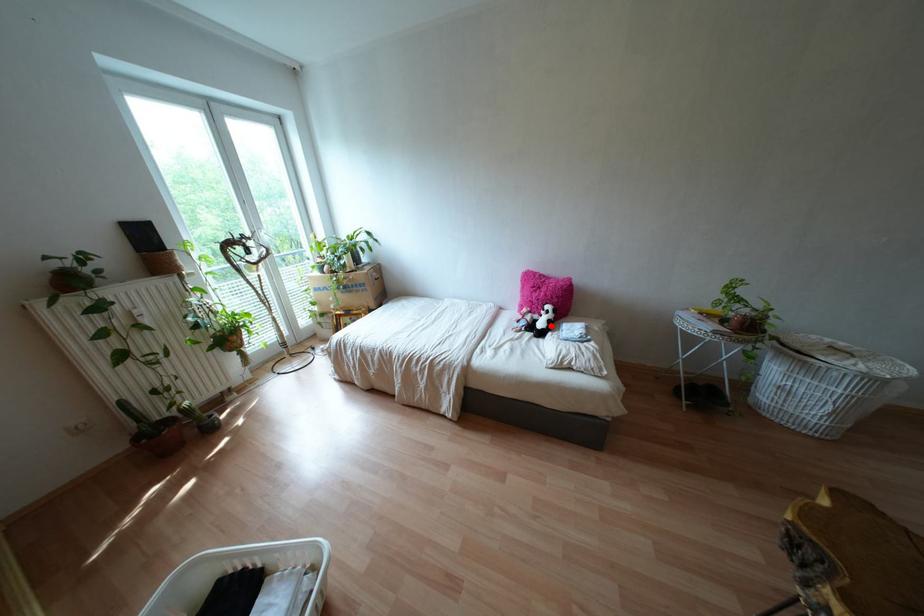
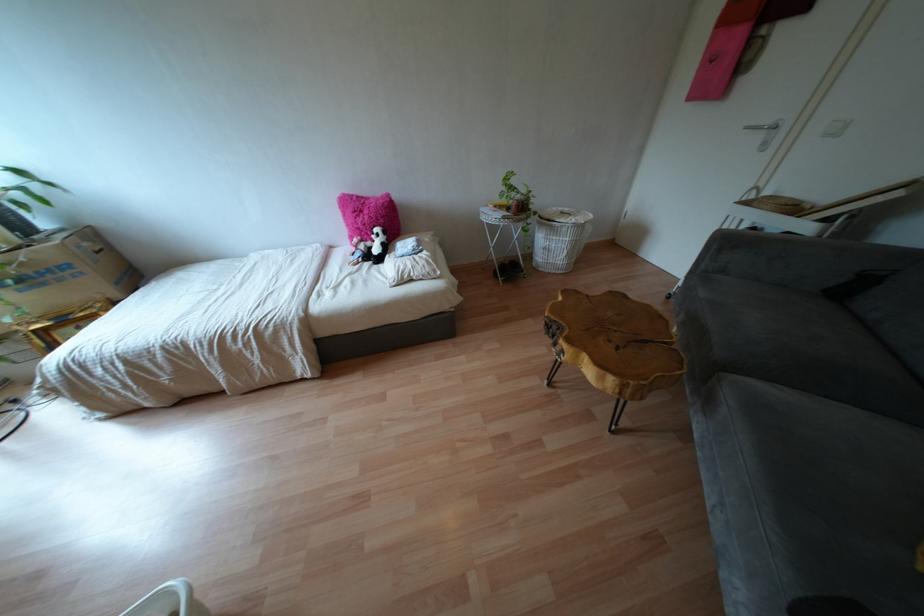
Find the pixel in the second image that matches the highlighted location in the first image.

(385, 248)